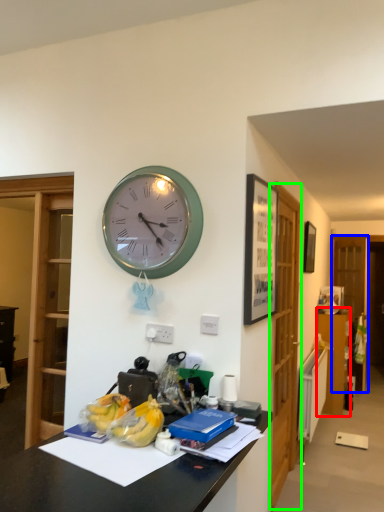
Question: Which object is positioned closest to dresser (highlighted by a red box)? Select from glass door (highlighted by a blue box) and glass door (highlighted by a green box).

Choices:
 (A) glass door
 (B) glass door

Answer: (A)